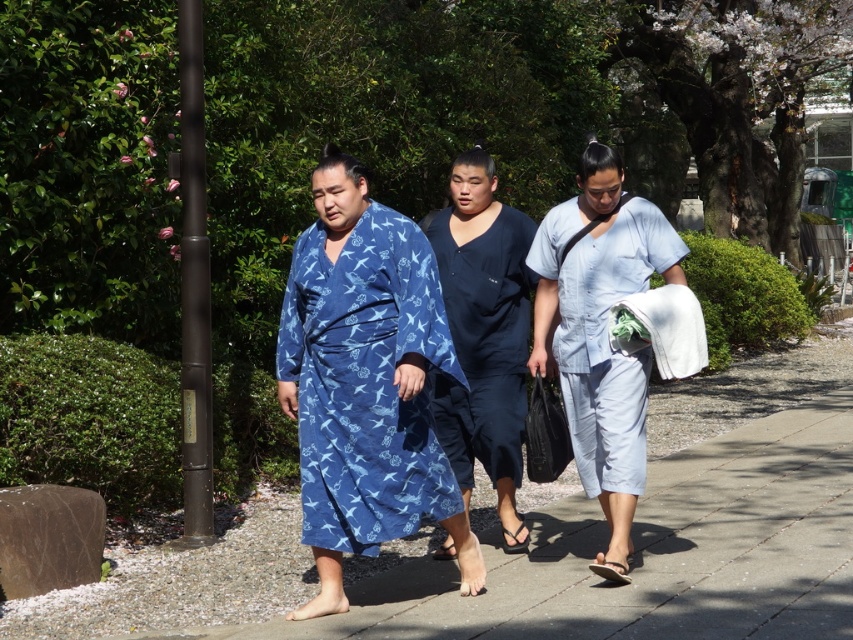
You are a delivery robot with a width of 16 inches. You need to pass between the light blue fabric at center and the dark blue fabric at center while carrying a package. Can you fit through the space between them?

The distance between the light blue fabric at center and the dark blue fabric at center is 18.21 inches. Since the robot is 16 inches wide, it can fit through the space as the gap is wider than the robot.

Looking at this image, you are a photographer trying to capture the scene. You want to ensure both the blue printed robe at center and the light blue fabric at center are in frame. From the perspective of the photographer standing behind the group, which side should you position yourself to include both subjects?

The blue printed robe at center is to the left of the light blue fabric at center. To include both in the frame from behind the group, the photographer should position themselves to the right side of the group so that both the left and right subjects are visible.